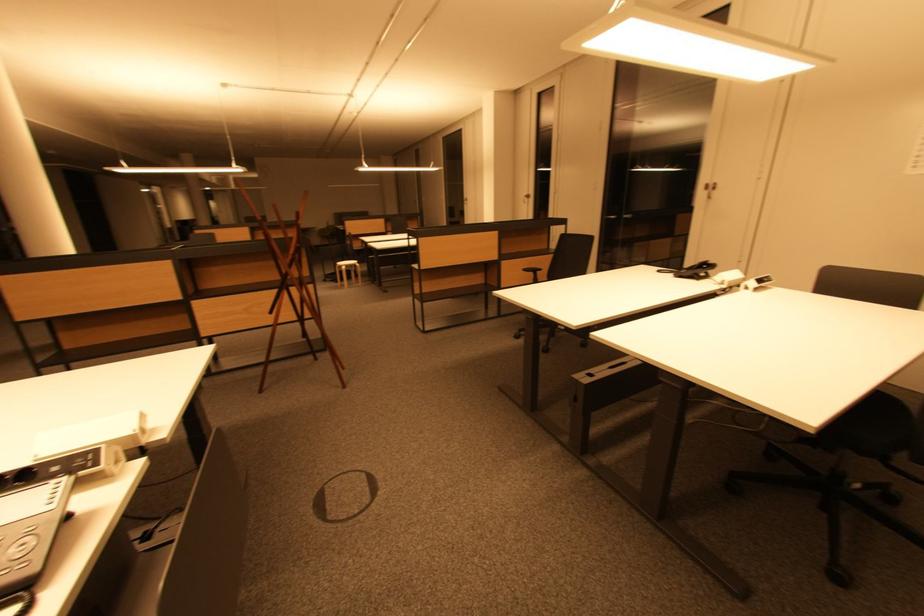
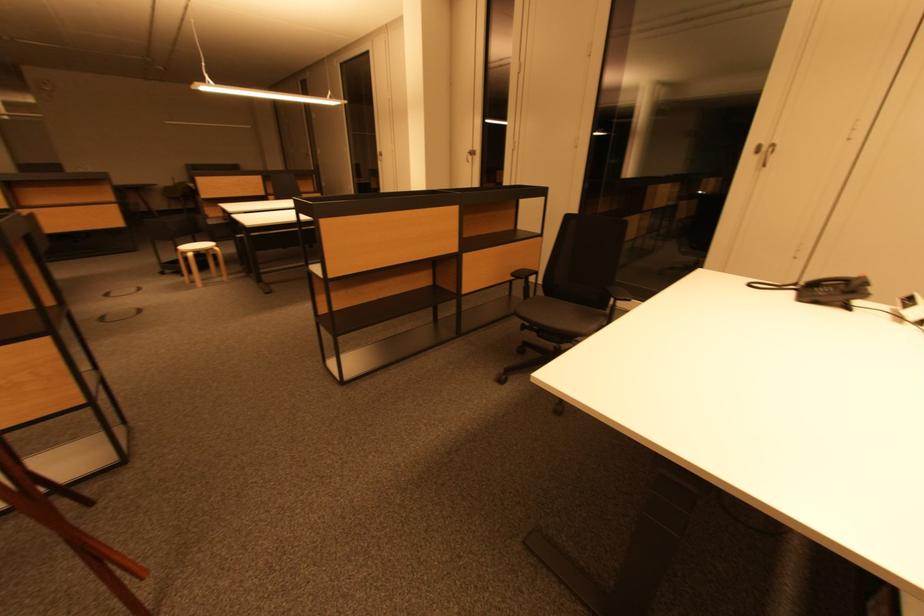
The point at (507, 265) is marked in the first image. Where is the corresponding point in the second image?

(470, 259)